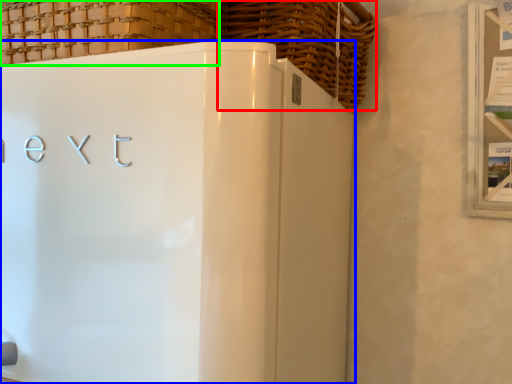
Question: Which object is the closest to the basket (highlighted by a red box)? Choose among these: refrigerator (highlighted by a blue box) or basket (highlighted by a green box).

Choices:
 (A) refrigerator
 (B) basket

Answer: (B)